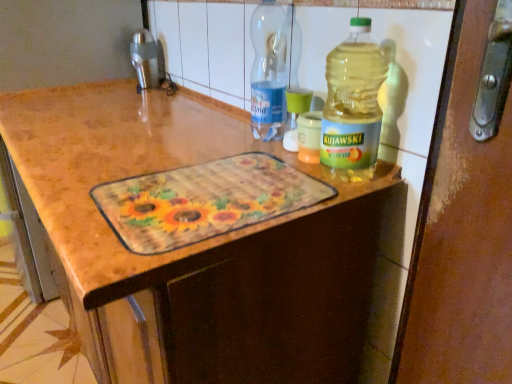
Question: Is point pos(263,97) closer or farther from the camera than point pos(347,112)?

Choices:
 (A) closer
 (B) farther

Answer: (B)

Question: Do you think transparent plastic bottle at center, which ranks as the 2th bottle in right-to-left order, is within translucent plastic bottle at upper right, marked as the 1th bottle in a front-to-back arrangement, or outside of it?

Choices:
 (A) outside
 (B) inside

Answer: (A)

Question: Based on their relative distances, which object is nearer to the translucent plastic bottle at upper right, marked as the 2th bottle in a left-to-right arrangement?

Choices:
 (A) metallic brushed faucet at upper left
 (B) transparent plastic bottle at center, which ranks as the 2th bottle in front-to-back order

Answer: (B)

Question: Which of these objects is positioned closest to the translucent plastic bottle at upper right, placed as the 1th bottle when sorted from right to left?

Choices:
 (A) transparent plastic bottle at center, arranged as the 1th bottle when viewed from the left
 (B) metallic brushed faucet at upper left

Answer: (A)